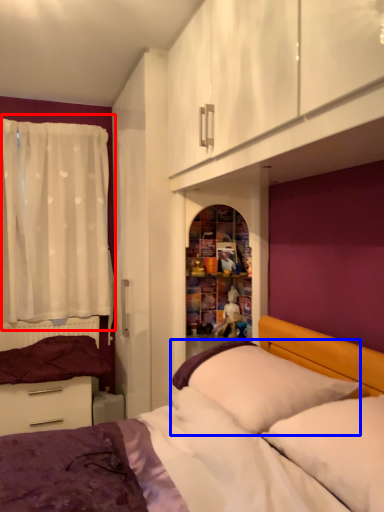
Question: Which point is further to the camera, curtain (highlighted by a red box) or pillow (highlighted by a blue box)?

Choices:
 (A) curtain
 (B) pillow

Answer: (A)